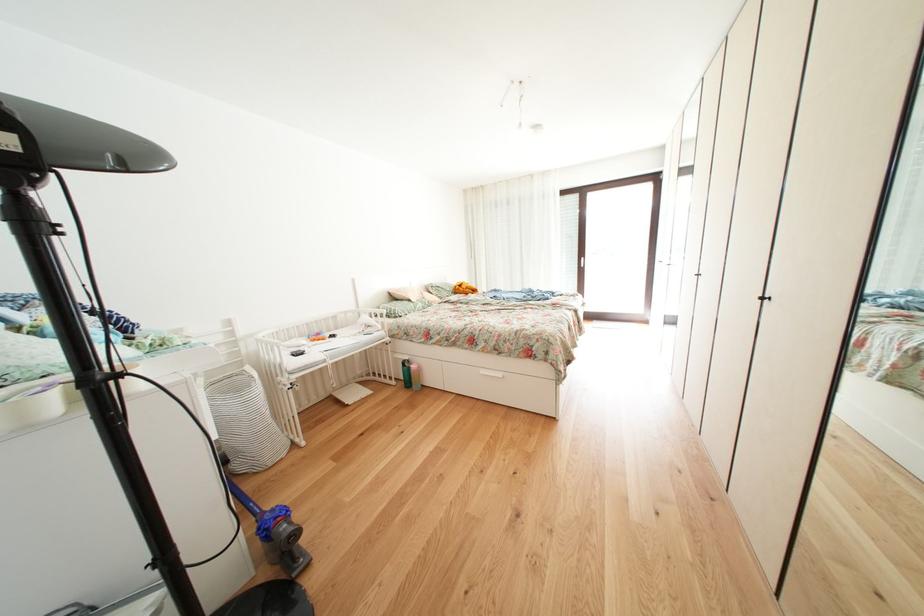
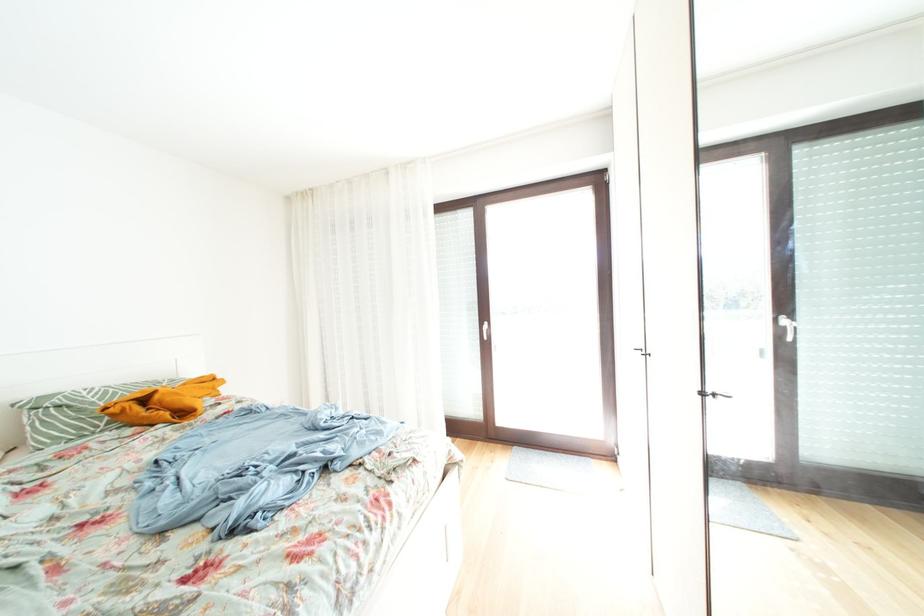
In a continuous first-person perspective shot, in which direction is the camera moving?

The cameraman moved toward right, forward.